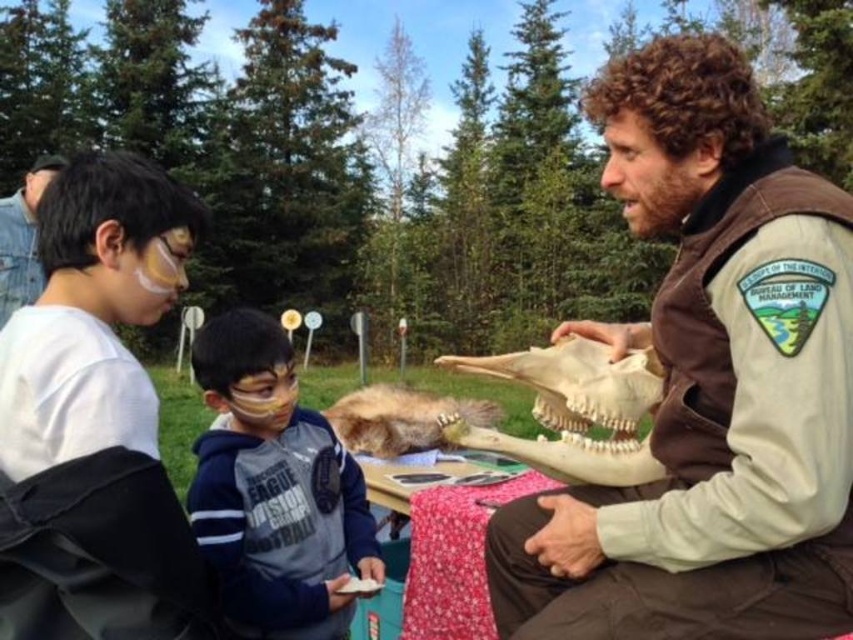
You are a participant in the event and want to get a closer look at the white bone skull at center. The event rules state that you must stay at least 5 feet away from any educational specimens. Can you safely approach the skull without violating the rules?

The white bone skull at center is 4.94 feet from the viewer. Since the required distance is 5 feet, approaching it would bring you within the restricted zone, violating the rule. Please maintain your current position.

You are standing at the point labeled point (x=527, y=374) and want to walk to the point labeled point (x=0, y=276). Which direction should you move to get closer to your destination?

To move from point (x=527, y=374) to point (x=0, y=276), you should move downward and to the left because point (x=0, y=276) is further away from the viewer compared to point (x=527, y=374).